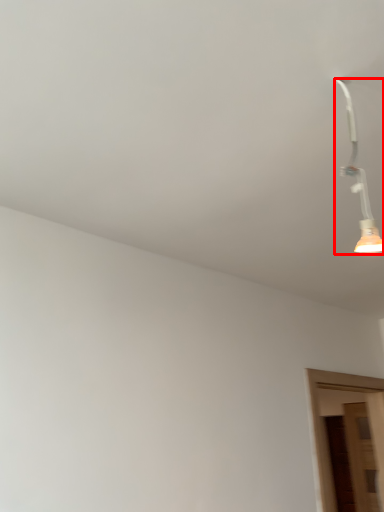
Question: From the image's perspective, considering the relative positions of lamp (annotated by the red box) and door in the image provided, where is lamp (annotated by the red box) located with respect to the staircase?

Choices:
 (A) above
 (B) below

Answer: (A)